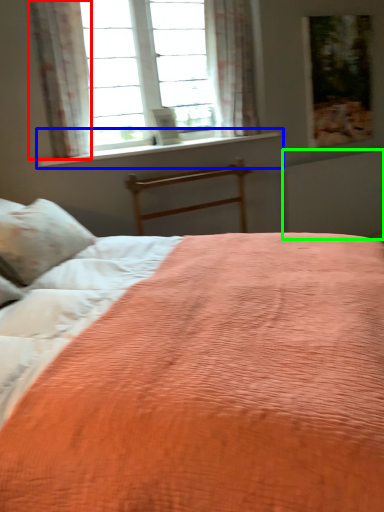
Question: Estimate the real-world distances between objects in this image. Which object is closer to curtain (highlighted by a red box), window sill (highlighted by a blue box) or radiator (highlighted by a green box)?

Choices:
 (A) window sill
 (B) radiator

Answer: (A)